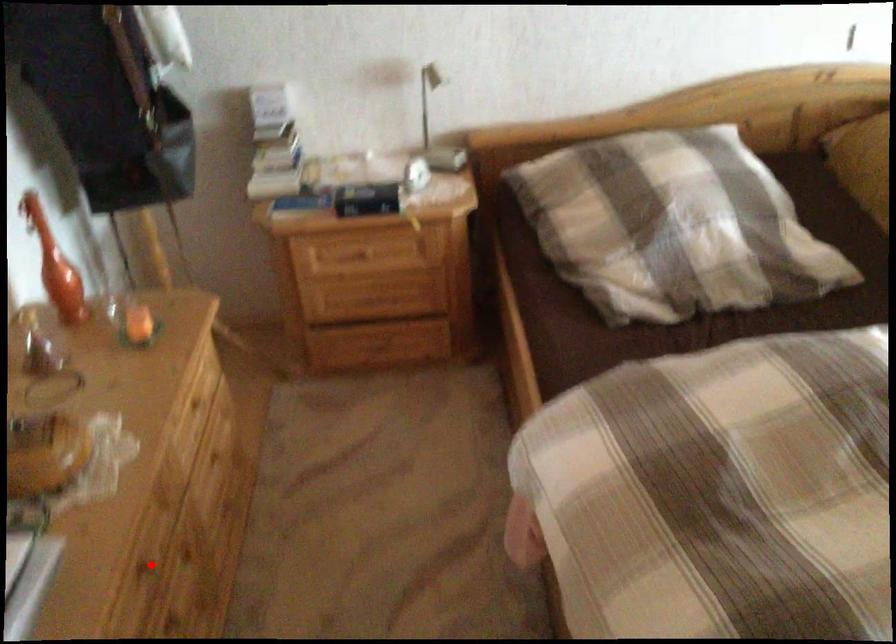
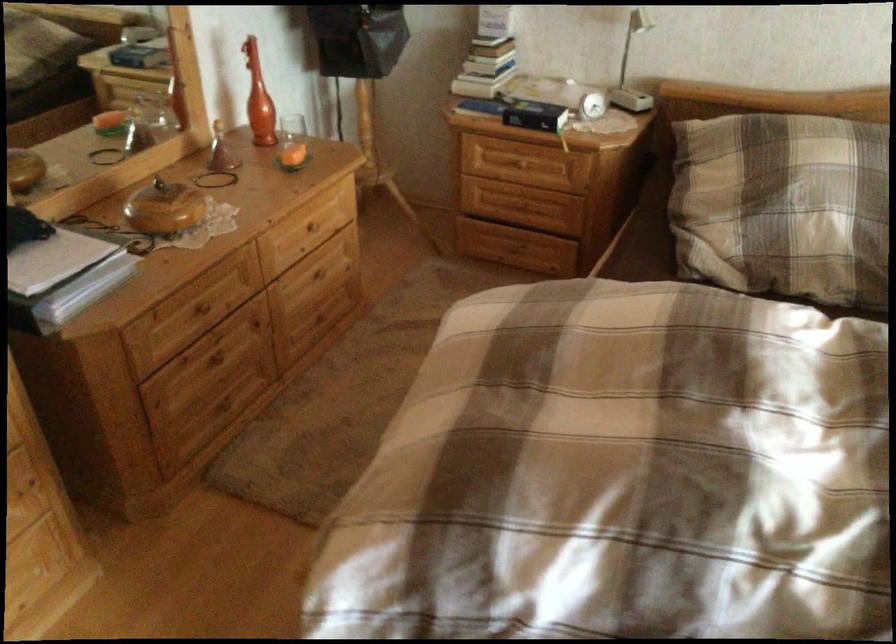
Question: I am providing you with two images of the same scene from different viewpoints. A red point is shown in image1. For the corresponding object point in image2, is it positioned nearer or farther from the camera?

Choices:
 (A) Nearer
 (B) Farther

Answer: (B)